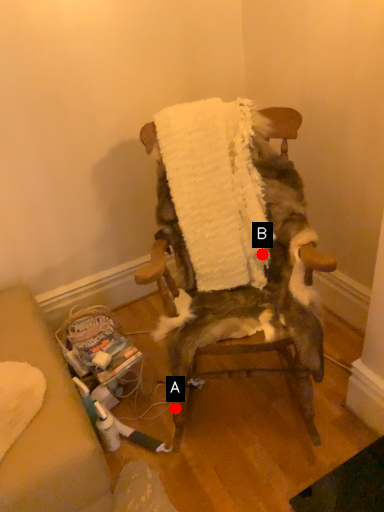
Question: Two points are circled on the image, labeled by A and B beside each circle. Which point appears farthest from the camera in this image?

Choices:
 (A) A is further
 (B) B is further

Answer: (A)